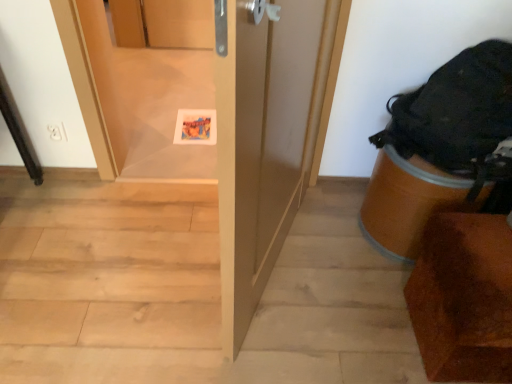
Question: Considering the relative sizes of matte paper postcard at center and transparent plastic screen door at center in the image provided, is matte paper postcard at center shorter than transparent plastic screen door at center?

Choices:
 (A) no
 (B) yes

Answer: (B)

Question: Is matte paper postcard at center at the right side of transparent plastic screen door at center?

Choices:
 (A) no
 (B) yes

Answer: (A)

Question: Considering the relative sizes of matte paper postcard at center and transparent plastic screen door at center in the image provided, is matte paper postcard at center smaller than transparent plastic screen door at center?

Choices:
 (A) no
 (B) yes

Answer: (B)

Question: From a real-world perspective, is matte paper postcard at center beneath transparent plastic screen door at center?

Choices:
 (A) yes
 (B) no

Answer: (A)

Question: Can you confirm if matte paper postcard at center is bigger than transparent plastic screen door at center?

Choices:
 (A) no
 (B) yes

Answer: (A)

Question: Is brown wood chair at lower right in front of or behind light wood stairwell at center in the image?

Choices:
 (A) behind
 (B) front

Answer: (B)

Question: From the image's perspective, is brown wood chair at lower right above or below light wood stairwell at center?

Choices:
 (A) below
 (B) above

Answer: (A)

Question: Considering the positions of brown wood chair at lower right and light wood stairwell at center in the image, is brown wood chair at lower right wider or thinner than light wood stairwell at center?

Choices:
 (A) wide
 (B) thin

Answer: (B)

Question: Would you say brown wood chair at lower right is to the left or to the right of light wood stairwell at center in the picture?

Choices:
 (A) right
 (B) left

Answer: (A)

Question: From a real-world perspective, is matte paper postcard at center positioned above or below transparent plastic screen door at center?

Choices:
 (A) below
 (B) above

Answer: (A)

Question: Is matte paper postcard at center bigger or smaller than transparent plastic screen door at center?

Choices:
 (A) small
 (B) big

Answer: (A)

Question: From the image's perspective, relative to transparent plastic screen door at center, is matte paper postcard at center above or below?

Choices:
 (A) above
 (B) below

Answer: (B)

Question: Is matte paper postcard at center in front of or behind transparent plastic screen door at center in the image?

Choices:
 (A) front
 (B) behind

Answer: (B)

Question: In the image, is black fabric backpack at right on the left side or the right side of brown wood chair at lower right?

Choices:
 (A) left
 (B) right

Answer: (A)

Question: From the image's perspective, is black fabric backpack at right located above or below brown wood chair at lower right?

Choices:
 (A) above
 (B) below

Answer: (A)